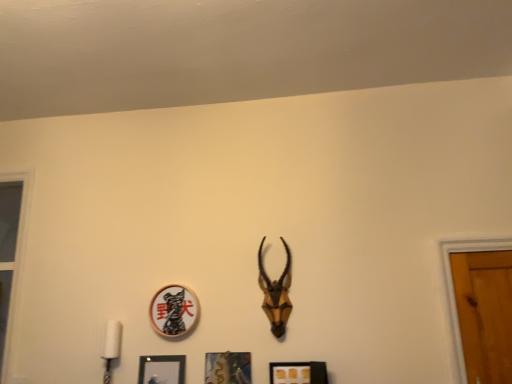
Describe the element at coordinates (298, 373) in the screenshot. I see `matte gold picture frame at lower center, the first picture frame in the right-to-left sequence` at that location.

What do you see at coordinates (174, 310) in the screenshot? The image size is (512, 384). I see `wooden circle at center, arranged as the second picture frame when viewed from the left` at bounding box center [174, 310].

Where is `brown matte antelope head at center`? brown matte antelope head at center is located at coordinates 276,293.

Is wooden circle at center, arranged as the second picture frame when viewed from the left, wider than black matte picture frame at lower center, acting as the first picture frame starting from the left?

Incorrect, the width of wooden circle at center, arranged as the second picture frame when viewed from the left, does not surpass that of black matte picture frame at lower center, acting as the first picture frame starting from the left.

Can you confirm if wooden circle at center, arranged as the second picture frame when viewed from the left, is bigger than black matte picture frame at lower center, acting as the first picture frame starting from the left?

No.

Would you say wooden circle at center, acting as the 3th picture frame starting from the right, is outside black matte picture frame at lower center, marked as the 4th picture frame in a right-to-left arrangement?

Absolutely, wooden circle at center, acting as the 3th picture frame starting from the right, is external to black matte picture frame at lower center, marked as the 4th picture frame in a right-to-left arrangement.

Relative to black matte picture frame at lower center, marked as the 4th picture frame in a right-to-left arrangement, is wooden circle at center, arranged as the second picture frame when viewed from the left, in front or behind?

Visually, wooden circle at center, arranged as the second picture frame when viewed from the left, is located behind black matte picture frame at lower center, marked as the 4th picture frame in a right-to-left arrangement.

Is brown matte antelope head at center not near metallic silver picture frame at center, the third picture frame in the left-to-right sequence?

No, brown matte antelope head at center is in close proximity to metallic silver picture frame at center, the third picture frame in the left-to-right sequence.

Which of these two, brown matte antelope head at center or metallic silver picture frame at center, the third picture frame in the left-to-right sequence, is smaller?

With smaller size is metallic silver picture frame at center, the third picture frame in the left-to-right sequence.

Which object is closer to the camera, brown matte antelope head at center or metallic silver picture frame at center, the third picture frame in the left-to-right sequence?

metallic silver picture frame at center, the third picture frame in the left-to-right sequence.

Between brown matte antelope head at center and metallic silver picture frame at center, marked as the 2th picture frame in a right-to-left arrangement, which one has smaller width?

metallic silver picture frame at center, marked as the 2th picture frame in a right-to-left arrangement.

From a real-world perspective, is brown matte antelope head at center below black matte picture frame at lower center, acting as the first picture frame starting from the left?

No, from a real-world perspective, brown matte antelope head at center is not beneath black matte picture frame at lower center, acting as the first picture frame starting from the left.

Considering the sizes of objects brown matte antelope head at center and black matte picture frame at lower center, marked as the 4th picture frame in a right-to-left arrangement, in the image provided, who is smaller, brown matte antelope head at center or black matte picture frame at lower center, marked as the 4th picture frame in a right-to-left arrangement,?

black matte picture frame at lower center, marked as the 4th picture frame in a right-to-left arrangement.

In terms of width, does brown matte antelope head at center look wider or thinner when compared to black matte picture frame at lower center, acting as the first picture frame starting from the left?

Clearly, brown matte antelope head at center has more width compared to black matte picture frame at lower center, acting as the first picture frame starting from the left.

Between brown matte antelope head at center and black matte picture frame at lower center, marked as the 4th picture frame in a right-to-left arrangement, which one is positioned in front?

brown matte antelope head at center.

From a real-world perspective, between matte gold picture frame at lower center, which appears as the 4th picture frame when viewed from the left, and black matte picture frame at lower center, acting as the first picture frame starting from the left, who is vertically lower?

In real-world perspective, matte gold picture frame at lower center, which appears as the 4th picture frame when viewed from the left, is lower.

Starting from the black matte picture frame at lower center, acting as the first picture frame starting from the left, which picture frame is the 3rd one to the right? Please provide its 2D coordinates.

[(298, 373)]

Consider the image. Is matte gold picture frame at lower center, the first picture frame in the right-to-left sequence, turned away from black matte picture frame at lower center, acting as the first picture frame starting from the left?

matte gold picture frame at lower center, the first picture frame in the right-to-left sequence, is not turned away from black matte picture frame at lower center, acting as the first picture frame starting from the left.

Is matte gold picture frame at lower center, which appears as the 4th picture frame when viewed from the left, positioned far away from black matte picture frame at lower center, acting as the first picture frame starting from the left?

That's not correct — matte gold picture frame at lower center, which appears as the 4th picture frame when viewed from the left, is a little close to black matte picture frame at lower center, acting as the first picture frame starting from the left.

Based on the photo, which is more to the left, brown matte antelope head at center or wooden circle at center, arranged as the second picture frame when viewed from the left?

From the viewer's perspective, wooden circle at center, arranged as the second picture frame when viewed from the left, appears more on the left side.

Is brown matte antelope head at center located outside wooden circle at center, arranged as the second picture frame when viewed from the left?

brown matte antelope head at center lies outside wooden circle at center, arranged as the second picture frame when viewed from the left,'s area.

Does brown matte antelope head at center turn towards wooden circle at center, acting as the 3th picture frame starting from the right?

No, brown matte antelope head at center is not aimed at wooden circle at center, acting as the 3th picture frame starting from the right.

From a real-world perspective, is wooden circle at center, acting as the 3th picture frame starting from the right, under matte gold picture frame at lower center, the first picture frame in the right-to-left sequence?

No, from a real-world perspective, wooden circle at center, acting as the 3th picture frame starting from the right, is not under matte gold picture frame at lower center, the first picture frame in the right-to-left sequence.

From their relative heights in the image, would you say wooden circle at center, acting as the 3th picture frame starting from the right, is taller or shorter than matte gold picture frame at lower center, the first picture frame in the right-to-left sequence?

In the image, wooden circle at center, acting as the 3th picture frame starting from the right, appears to be taller than matte gold picture frame at lower center, the first picture frame in the right-to-left sequence.

Is wooden circle at center, arranged as the second picture frame when viewed from the left, wider or thinner than matte gold picture frame at lower center, the first picture frame in the right-to-left sequence?

Considering their sizes, wooden circle at center, arranged as the second picture frame when viewed from the left, looks broader than matte gold picture frame at lower center, the first picture frame in the right-to-left sequence.

Consider the image. Measure the distance from wooden circle at center, arranged as the second picture frame when viewed from the left, to matte gold picture frame at lower center, the first picture frame in the right-to-left sequence.

wooden circle at center, arranged as the second picture frame when viewed from the left, and matte gold picture frame at lower center, the first picture frame in the right-to-left sequence, are 22.16 inches apart.

Is there a large distance between metallic silver picture frame at center, the third picture frame in the left-to-right sequence, and matte gold picture frame at lower center, which appears as the 4th picture frame when viewed from the left?

No, metallic silver picture frame at center, the third picture frame in the left-to-right sequence, is not far away from matte gold picture frame at lower center, which appears as the 4th picture frame when viewed from the left.

Is metallic silver picture frame at center, marked as the 2th picture frame in a right-to-left arrangement, positioned beyond the bounds of matte gold picture frame at lower center, the first picture frame in the right-to-left sequence?

That's correct, metallic silver picture frame at center, marked as the 2th picture frame in a right-to-left arrangement, is outside of matte gold picture frame at lower center, the first picture frame in the right-to-left sequence.

Is point (220, 382) more distant than point (305, 373)?

That is True.

Is metallic silver picture frame at center, the third picture frame in the left-to-right sequence, wider than matte gold picture frame at lower center, which appears as the 4th picture frame when viewed from the left?

In fact, metallic silver picture frame at center, the third picture frame in the left-to-right sequence, might be narrower than matte gold picture frame at lower center, which appears as the 4th picture frame when viewed from the left.

Image resolution: width=512 pixels, height=384 pixels. In order to click on the 2nd picture frame above the black matte picture frame at lower center, marked as the 4th picture frame in a right-to-left arrangement (from a real-world perspective) in this screenshot , I will do `click(174, 310)`.

From a real-world perspective, which picture frame is the 2nd one underneath the brown matte antelope head at center? Please provide its 2D coordinates.

[(228, 368)]

From the picture: Looking at the image, which one is located closer to matte gold picture frame at lower center, which appears as the 4th picture frame when viewed from the left, black matte picture frame at lower center, marked as the 4th picture frame in a right-to-left arrangement, or brown matte antelope head at center?

brown matte antelope head at center is positioned closer to the anchor matte gold picture frame at lower center, which appears as the 4th picture frame when viewed from the left.

Estimate the real-world distances between objects in this image. Which object is further from wooden circle at center, acting as the 3th picture frame starting from the right, black matte picture frame at lower center, marked as the 4th picture frame in a right-to-left arrangement, or metallic silver picture frame at center, the third picture frame in the left-to-right sequence?

Based on the image, metallic silver picture frame at center, the third picture frame in the left-to-right sequence, appears to be further to wooden circle at center, acting as the 3th picture frame starting from the right.

Looking at this image, looking at the image, which one is located closer to wooden circle at center, arranged as the second picture frame when viewed from the left, metallic silver picture frame at center, the third picture frame in the left-to-right sequence, or matte gold picture frame at lower center, which appears as the 4th picture frame when viewed from the left?

metallic silver picture frame at center, the third picture frame in the left-to-right sequence, is positioned closer to the anchor wooden circle at center, arranged as the second picture frame when viewed from the left.

Looking at the image, which one is located further to matte gold picture frame at lower center, which appears as the 4th picture frame when viewed from the left, black matte picture frame at lower center, acting as the first picture frame starting from the left, or metallic silver picture frame at center, marked as the 2th picture frame in a right-to-left arrangement?

Based on the image, black matte picture frame at lower center, acting as the first picture frame starting from the left, appears to be further to matte gold picture frame at lower center, which appears as the 4th picture frame when viewed from the left.

Which object lies further to the anchor point black matte picture frame at lower center, acting as the first picture frame starting from the left, matte gold picture frame at lower center, the first picture frame in the right-to-left sequence, or metallic silver picture frame at center, the third picture frame in the left-to-right sequence?

matte gold picture frame at lower center, the first picture frame in the right-to-left sequence, is further to black matte picture frame at lower center, acting as the first picture frame starting from the left.

When comparing their distances from metallic silver picture frame at center, the third picture frame in the left-to-right sequence, does brown matte antelope head at center or matte gold picture frame at lower center, the first picture frame in the right-to-left sequence, seem closer?

matte gold picture frame at lower center, the first picture frame in the right-to-left sequence.

Based on their spatial positions, is matte gold picture frame at lower center, which appears as the 4th picture frame when viewed from the left, or wooden circle at center, acting as the 3th picture frame starting from the right, closer to metallic silver picture frame at center, the third picture frame in the left-to-right sequence?

Among the two, matte gold picture frame at lower center, which appears as the 4th picture frame when viewed from the left, is located nearer to metallic silver picture frame at center, the third picture frame in the left-to-right sequence.

Which object lies further to the anchor point metallic silver picture frame at center, the third picture frame in the left-to-right sequence, wooden circle at center, acting as the 3th picture frame starting from the right, or brown matte antelope head at center?

brown matte antelope head at center lies further to metallic silver picture frame at center, the third picture frame in the left-to-right sequence, than the other object.

Locate an element on the screen. The height and width of the screenshot is (384, 512). picture frame situated between wooden circle at center, acting as the 3th picture frame starting from the right, and matte gold picture frame at lower center, the first picture frame in the right-to-left sequence, from left to right is located at coordinates (228, 368).

The width and height of the screenshot is (512, 384). I want to click on picture frame situated between wooden circle at center, acting as the 3th picture frame starting from the right, and brown matte antelope head at center from left to right, so (x=228, y=368).

Identify the location of antelope located between wooden circle at center, acting as the 3th picture frame starting from the right, and matte gold picture frame at lower center, which appears as the 4th picture frame when viewed from the left, in the left-right direction. The image size is (512, 384). (276, 293).

Find the location of a particular element. antelope between black matte picture frame at lower center, marked as the 4th picture frame in a right-to-left arrangement, and matte gold picture frame at lower center, the first picture frame in the right-to-left sequence, from left to right is located at coordinates (276, 293).